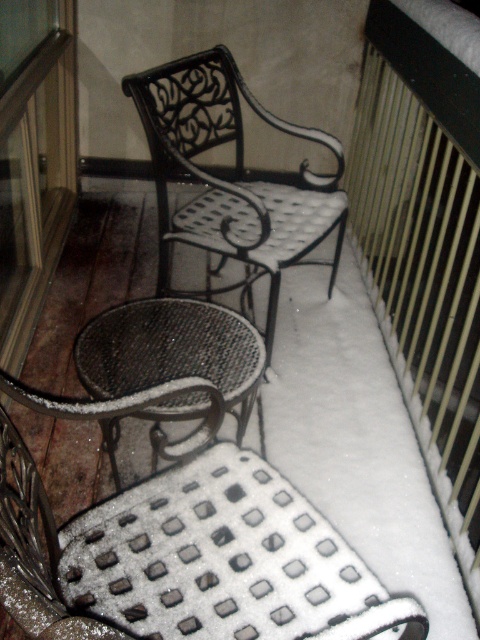
In the scene shown: You are standing on the snow covered balcony and want to sit down. You see the metallic mesh chair at lower center. Is the chair located closer to the left or right side of the balcony?

The metallic mesh chair at lower center is located at point 0.852 on the x axis, which is closer to the right side of the balcony.

Based on the photo, you are standing on the balcony and want to sit down. Which object at point (213, 545) should you choose?

The metallic mesh chair at lower center is located at point (213, 545), so you should choose the metallic mesh chair at lower center.